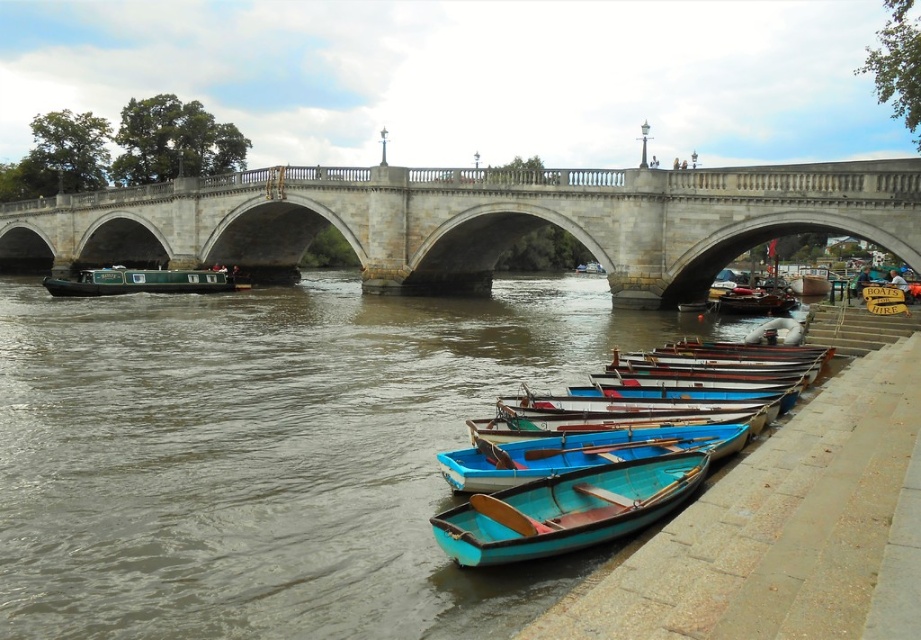
Question: Considering the relative positions of stone bridge at center and green matte barge at left in the image provided, where is stone bridge at center located with respect to green matte barge at left?

Choices:
 (A) left
 (B) right

Answer: (B)

Question: Considering the real-world distances, which object is farthest from the brown matte water at lower left?

Choices:
 (A) teal wooden canoe at lower center
 (B) teal matte canoe at lower right
 (C) green matte barge at left
 (D) stone bridge at center

Answer: (C)

Question: Is teal wooden canoe at lower center smaller than green matte barge at left?

Choices:
 (A) no
 (B) yes

Answer: (B)

Question: Which of the following is the closest to the observer?

Choices:
 (A) (745, 422)
 (B) (329, 545)
 (C) (213, 284)
 (D) (253, 208)

Answer: (B)

Question: Does brown matte water at lower left have a smaller size compared to teal matte canoe at lower right?

Choices:
 (A) yes
 (B) no

Answer: (B)

Question: Among these points, which one is farthest from the camera?

Choices:
 (A) (657, 305)
 (B) (481, 515)
 (C) (72, 285)

Answer: (C)